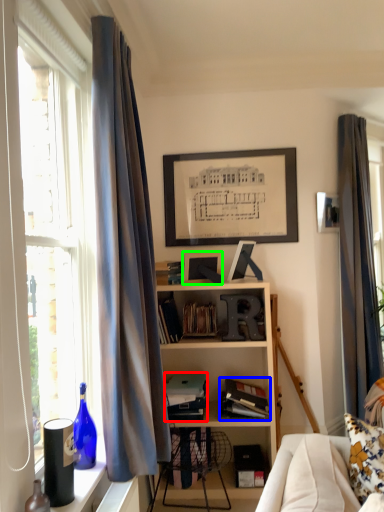
Question: Which is farther away from book (highlighted by a red box)? book (highlighted by a blue box) or picture frame (highlighted by a green box)?

Choices:
 (A) book
 (B) picture frame

Answer: (B)